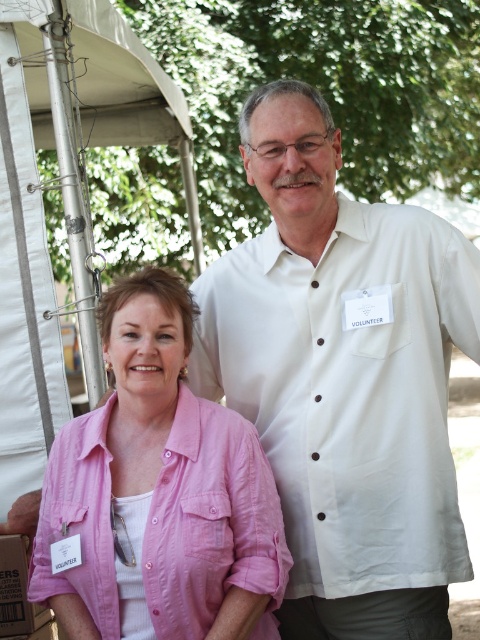
Question: Which point is farther to the camera?

Choices:
 (A) (168, 269)
 (B) (403, 292)
 (C) (22, 582)

Answer: (A)

Question: Which object is the farthest from the pink cotton shirt at center?

Choices:
 (A) white fabric tent at upper left
 (B) white cotton shirt at upper right
 (C) cardboard box at lower left

Answer: (A)

Question: Can you confirm if pink cotton shirt at center is positioned to the left of cardboard box at lower left?

Choices:
 (A) yes
 (B) no

Answer: (B)

Question: Does white cotton shirt at upper right have a smaller size compared to pink cotton shirt at center?

Choices:
 (A) yes
 (B) no

Answer: (B)

Question: Considering the relative positions of pink cotton shirt at center and cardboard box at lower left in the image provided, where is pink cotton shirt at center located with respect to cardboard box at lower left?

Choices:
 (A) below
 (B) above

Answer: (B)

Question: Which point is closer to the camera?

Choices:
 (A) [70, 513]
 (B) [76, 232]
 (C) [393, 545]
 (D) [23, 582]

Answer: (A)